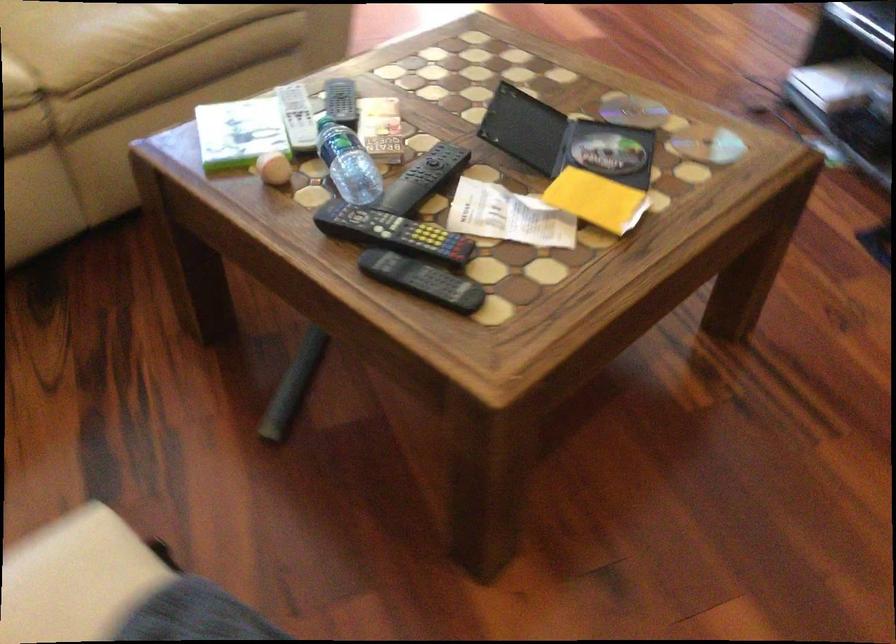
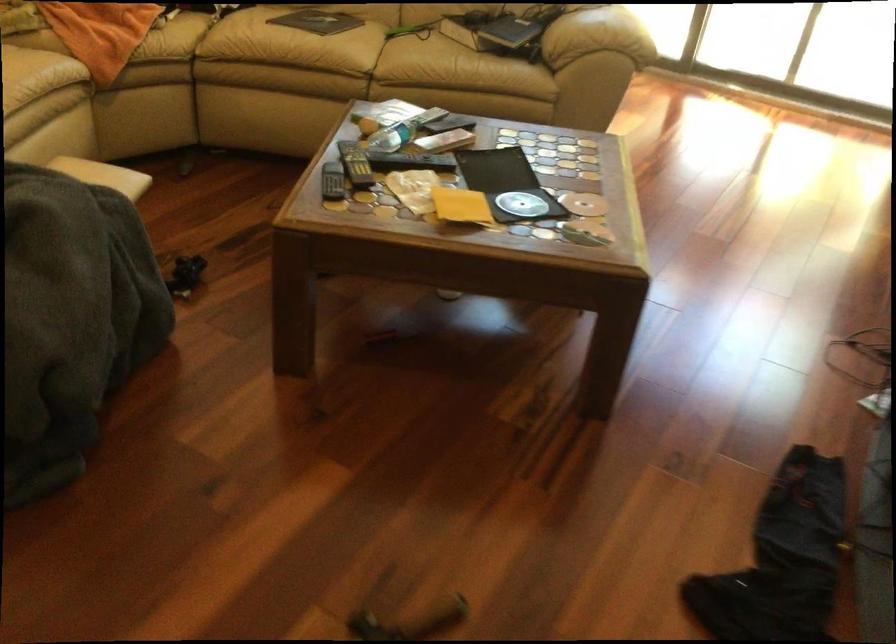
In the second image, find the point that corresponds to (549,138) in the first image.

(506, 184)